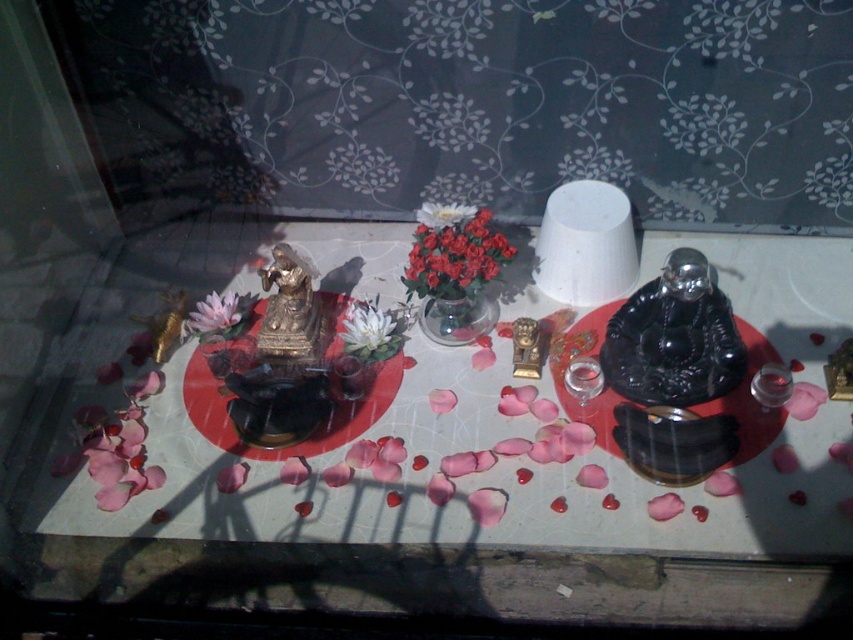
Who is lower down, gold metallic statue at center or pink matte flower at center?

Positioned lower is pink matte flower at center.

Does point (288, 316) lie behind point (234, 314)?

No, it is in front of (234, 314).

Describe the element at coordinates (289, 308) in the screenshot. I see `gold metallic statue at center` at that location.

I want to click on gold metallic statue at center, so click(x=289, y=308).

Consider the image. Which is more to the left, white matte flower at center or pink matte flower at center?

pink matte flower at center is more to the left.

Does point (393, 337) lie in front of point (225, 324)?

No, it is behind (225, 324).

Who is more forward, (357,332) or (228,337)?

Point (357,332) is more forward.

Find the location of a particular element. white matte flower at center is located at coordinates (369, 332).

Does red matte flowers at center have a greater width compared to white matte flower at center?

Yes.

This screenshot has width=853, height=640. I want to click on red matte flowers at center, so click(453, 252).

Is point (454, 234) closer to camera compared to point (364, 304)?

Yes, it is in front of point (364, 304).

Identify the location of red matte flowers at center. The width and height of the screenshot is (853, 640). click(x=453, y=252).